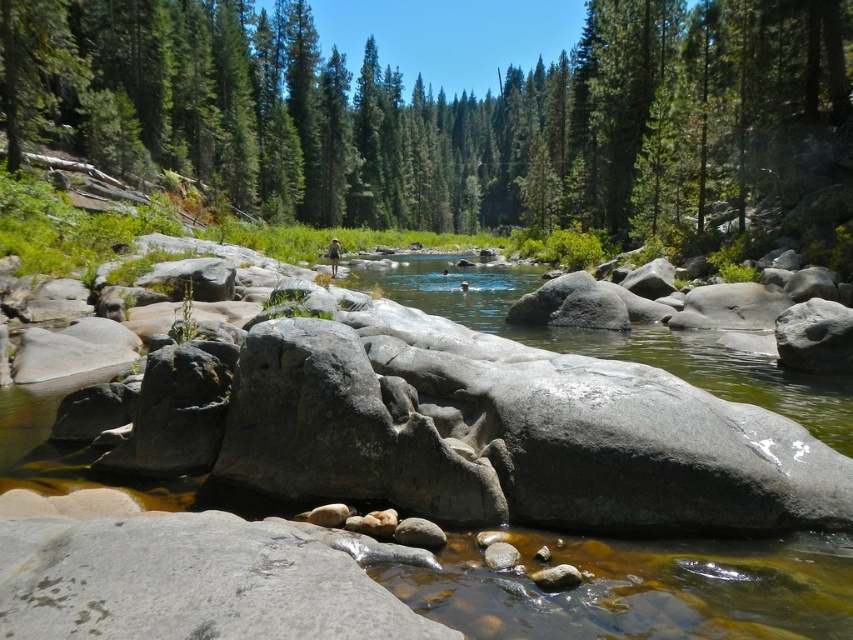
Question: Can you confirm if gray rock pool at center is positioned above smooth gray rock at center?

Choices:
 (A) no
 (B) yes

Answer: (B)

Question: Based on their relative distances, which object is farther from the gray rock pool at center?

Choices:
 (A) green matte forest at center
 (B) smooth gray rock at center

Answer: (A)

Question: Can you confirm if green matte forest at center is positioned above smooth gray rock at center?

Choices:
 (A) no
 (B) yes

Answer: (B)

Question: Is green matte forest at center closer to camera compared to smooth gray rock at center?

Choices:
 (A) yes
 (B) no

Answer: (B)

Question: Among these objects, which one is nearest to the camera?

Choices:
 (A) gray rock pool at center
 (B) smooth gray rock at center
 (C) green matte forest at center

Answer: (B)

Question: Which is nearer to the green matte forest at center?

Choices:
 (A) smooth gray rock at center
 (B) gray rock pool at center

Answer: (B)